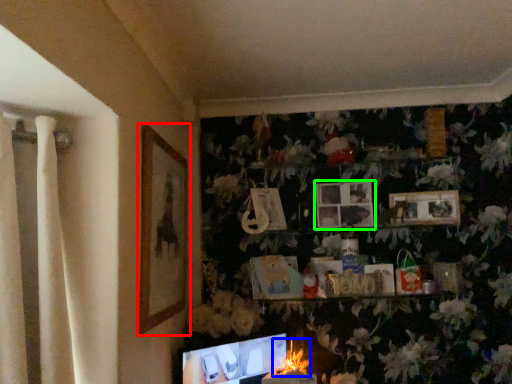
Question: Considering the real-world distances, which object is farthest from picture frame (highlighted by a red box)? flower (highlighted by a blue box) or picture frame (highlighted by a green box)?

Choices:
 (A) flower
 (B) picture frame

Answer: (B)